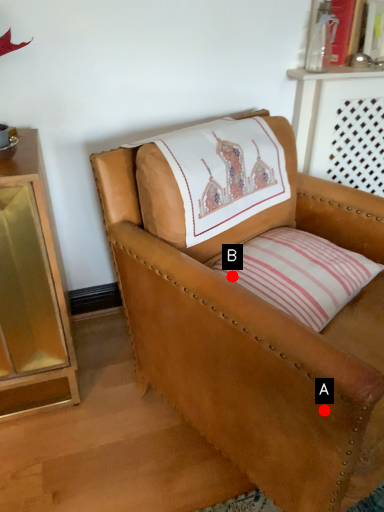
Question: Two points are circled on the image, labeled by A and B beside each circle. Which point is farther to the camera?

Choices:
 (A) A is further
 (B) B is further

Answer: (B)